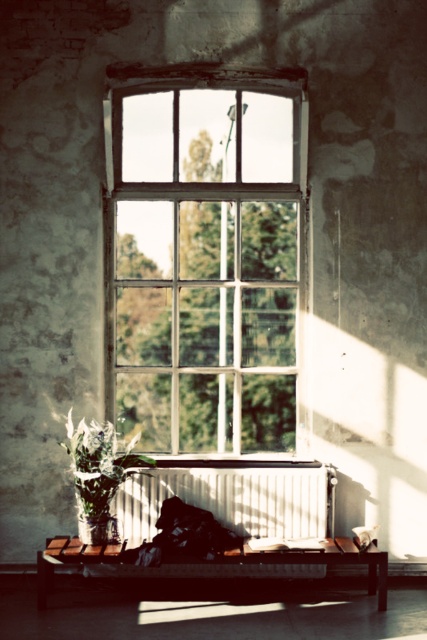
You are a guest in this room and want to sit on the velvety black pillow at lower right. Can you tell me if the green matte plant at lower left is bigger than the pillow?

The green matte plant at lower left is larger in size than velvety black pillow at lower right, so yes, the plant is bigger than the pillow.

You are standing in the room and want to place a small decorative item on the wooden bench in front of the window. The bench is positioned at point 0.741, 0.232. Where should you place the item to ensure it is not obstructed by the green matte plant at lower left?

The green matte plant at lower left is located at point (99, 474), so you should place the item elsewhere on the bench to avoid obstruction.